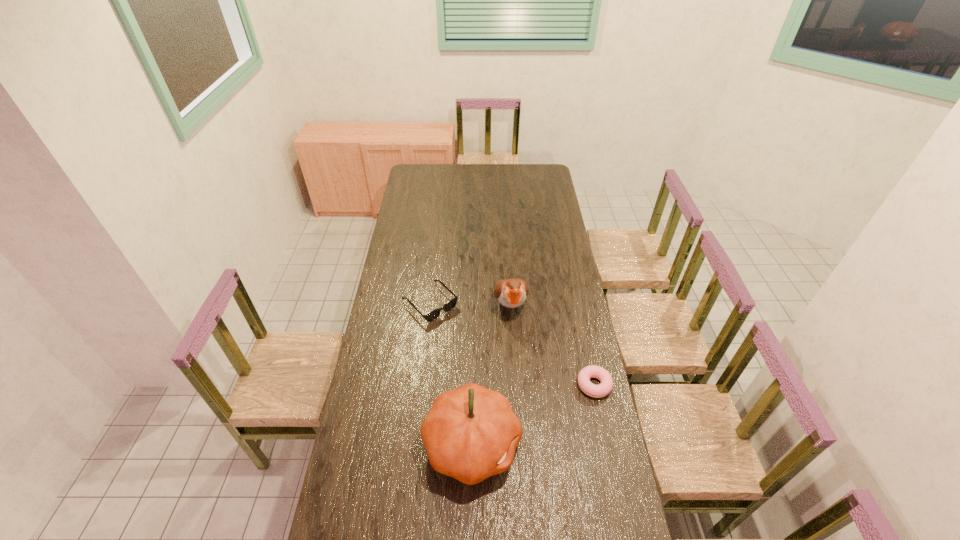
Identify the location of vacant region located at the front lenses of the sunglasses. The height and width of the screenshot is (540, 960). [x=479, y=353].

The height and width of the screenshot is (540, 960). In order to click on free space located 0.350m at the front lenses of the sunglasses in this screenshot , I will do `click(498, 372)`.

Locate an element on the screen. This screenshot has height=540, width=960. vacant space located at the front lenses of the sunglasses is located at coordinates (505, 379).

Find the location of a particular element. object that is at the left edge is located at coordinates (434, 314).

Find the location of `object present at the right edge`. object present at the right edge is located at coordinates (605, 387).

Find the location of a particular element. This screenshot has width=960, height=540. vacant area at the far edge is located at coordinates (484, 164).

In the image, there is a desktop. What are the coordinates of `vacant space at the left edge` in the screenshot? It's located at (363, 462).

I want to click on free space at the right edge, so click(x=532, y=186).

The height and width of the screenshot is (540, 960). In the image, there is a desktop. Find the location of `vacant area at the near left corner`. vacant area at the near left corner is located at coordinates (352, 517).

Where is `vacant space at the far right corner`? vacant space at the far right corner is located at coordinates (538, 182).